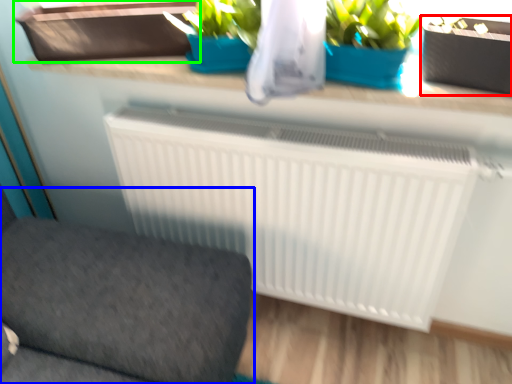
Question: Based on their relative distances, which object is nearer to flowerpot (highlighted by a red box)? Choose from furniture (highlighted by a blue box) and window box (highlighted by a green box).

Choices:
 (A) furniture
 (B) window box

Answer: (B)